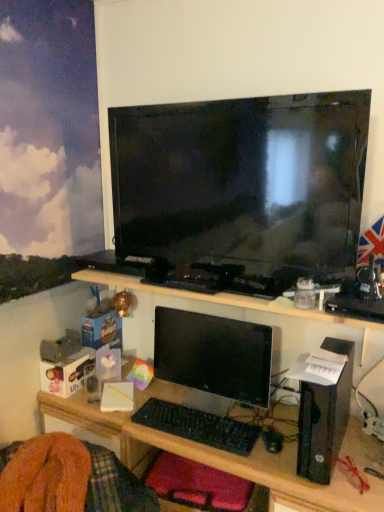
Where is `vacant region to the right of black plastic mouse at lower center`? The image size is (384, 512). vacant region to the right of black plastic mouse at lower center is located at coordinates (336, 446).